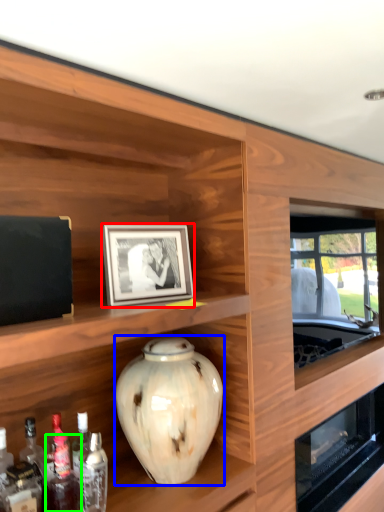
Question: Which object is positioned farthest from picture frame (highlighted by a red box)? Select from vase (highlighted by a blue box) and bottle (highlighted by a green box).

Choices:
 (A) vase
 (B) bottle

Answer: (B)